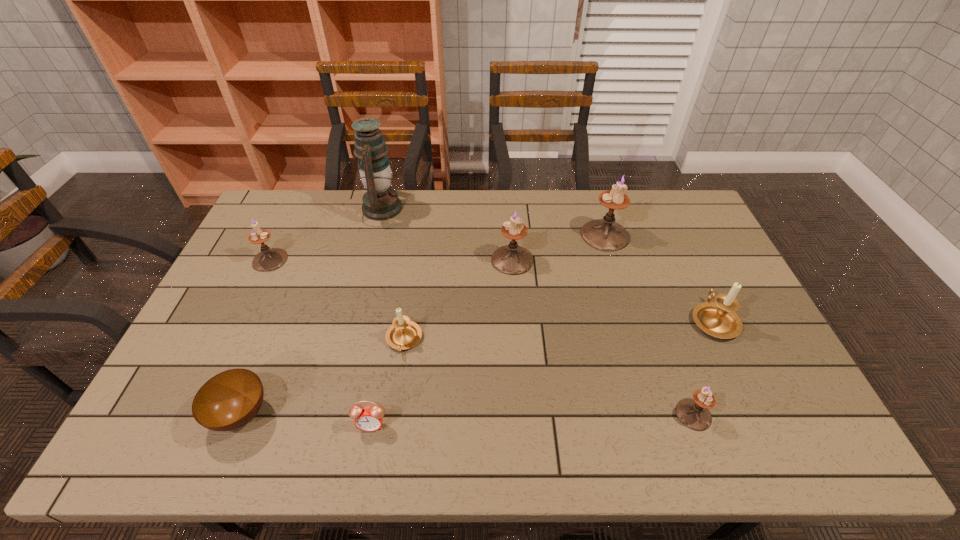
Where is `bowl positioned at the near edge`? bowl positioned at the near edge is located at coordinates (231, 399).

Where is `candle holder present at the left edge`? candle holder present at the left edge is located at coordinates (269, 259).

Identify the location of bowl present at the left edge. This screenshot has width=960, height=540. (231, 399).

Find the location of a particular element. object that is at the right edge is located at coordinates (719, 319).

The height and width of the screenshot is (540, 960). Identify the location of object that is positioned at the near left corner. (231, 399).

Locate an element on the screen. This screenshot has height=540, width=960. blank space at the far edge of the desktop is located at coordinates (420, 212).

What are the coordinates of `vacant area at the near edge of the desktop` in the screenshot? It's located at (597, 429).

You are a GUI agent. You are given a task and a screenshot of the screen. Output one action in this format:
    pyautogui.click(x=<x>, y=<y>)
    Task: Click on the free point at the left edge
    This screenshot has width=960, height=540.
    Given the screenshot: What is the action you would take?
    coord(247,295)

The image size is (960, 540). I want to click on vacant space at the right edge of the desktop, so click(x=712, y=262).

In the image, there is a desktop. At what (x,y) coordinates should I click in order to perform the action: click on free space at the far right corner. Please return your answer as a coordinate pair (x, y). This screenshot has width=960, height=540. Looking at the image, I should click on (649, 203).